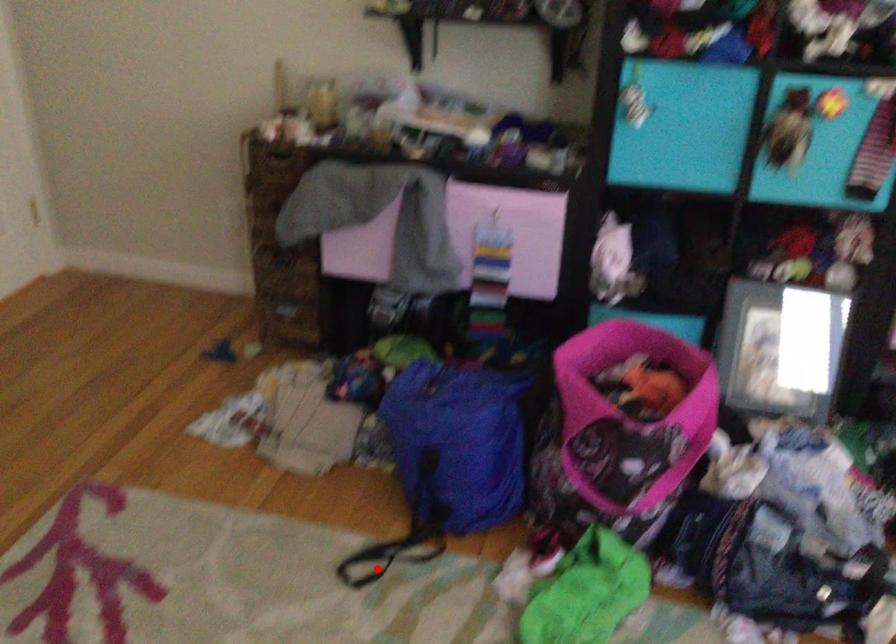
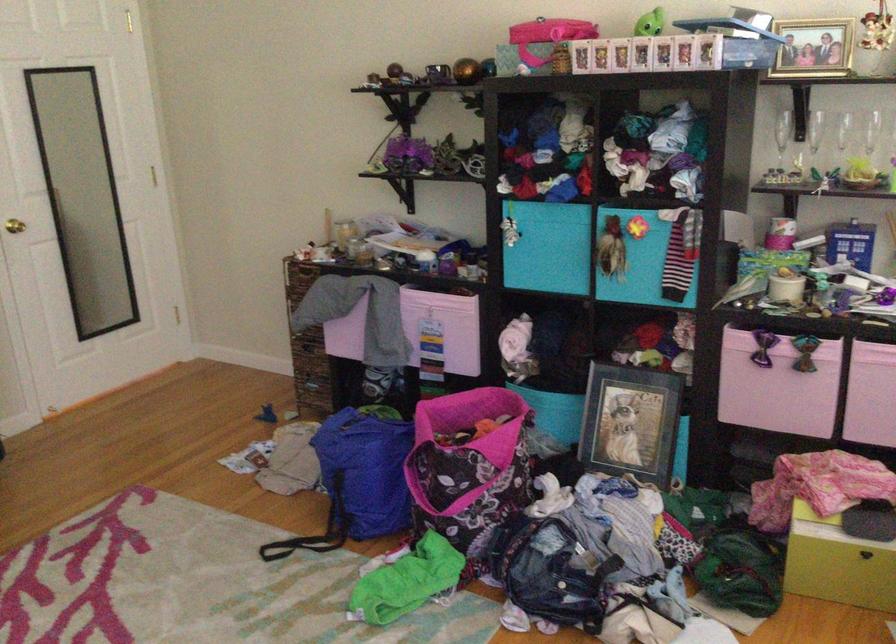
Find the pixel in the second image that matches the highlighted location in the first image.

(288, 547)